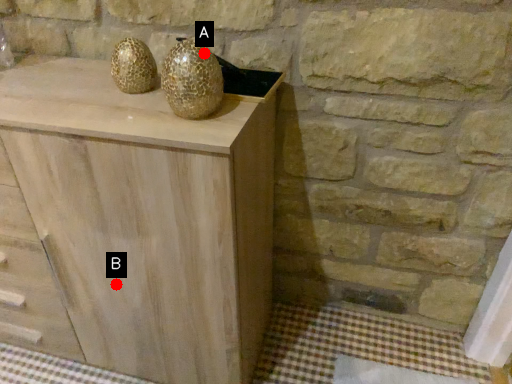
Question: Two points are circled on the image, labeled by A and B beside each circle. Which point is closer to the camera taking this photo?

Choices:
 (A) A is closer
 (B) B is closer

Answer: (A)